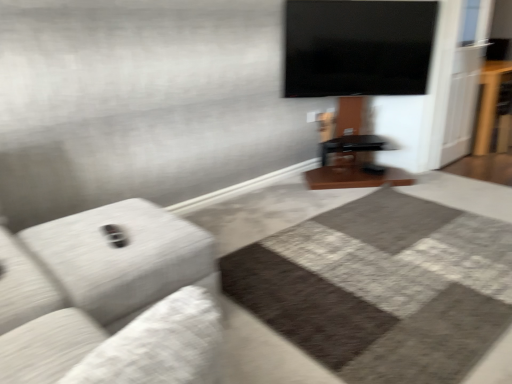
Question: Does point (488, 71) appear closer or farther from the camera than point (92, 292)?

Choices:
 (A) farther
 (B) closer

Answer: (A)

Question: Would you say brown wooden table at right is to the left or to the right of light gray fabric couch at left in the picture?

Choices:
 (A) left
 (B) right

Answer: (B)

Question: Looking at their shapes, would you say brown wooden table at right is wider or thinner than light gray fabric couch at left?

Choices:
 (A) wide
 (B) thin

Answer: (B)

Question: Based on their sizes in the image, would you say light gray fabric couch at left is bigger or smaller than brown wooden table at right?

Choices:
 (A) small
 (B) big

Answer: (A)

Question: Is light gray fabric couch at left wider or thinner than brown wooden table at right?

Choices:
 (A) wide
 (B) thin

Answer: (A)

Question: From a real-world perspective, is light gray fabric couch at left above or below brown wooden table at right?

Choices:
 (A) below
 (B) above

Answer: (A)

Question: Considering the positions of point (131, 321) and point (490, 79), is point (131, 321) closer or farther from the camera than point (490, 79)?

Choices:
 (A) closer
 (B) farther

Answer: (A)